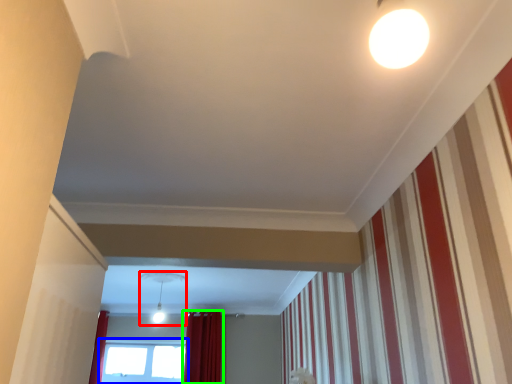
Question: Which object is the closest to the light fixture (highlighted by a red box)? Choose among these: window (highlighted by a blue box) or curtain (highlighted by a green box).

Choices:
 (A) window
 (B) curtain

Answer: (B)